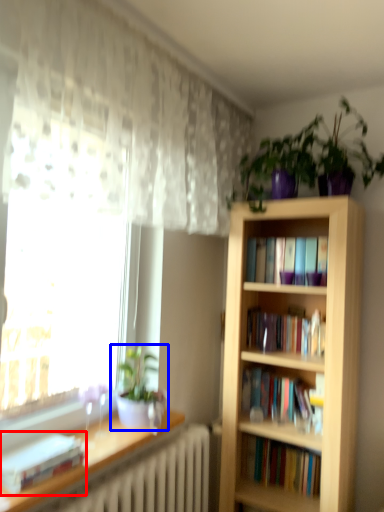
Question: Which object is further to the camera taking this photo, book (highlighted by a red box) or houseplant (highlighted by a blue box)?

Choices:
 (A) book
 (B) houseplant

Answer: (B)